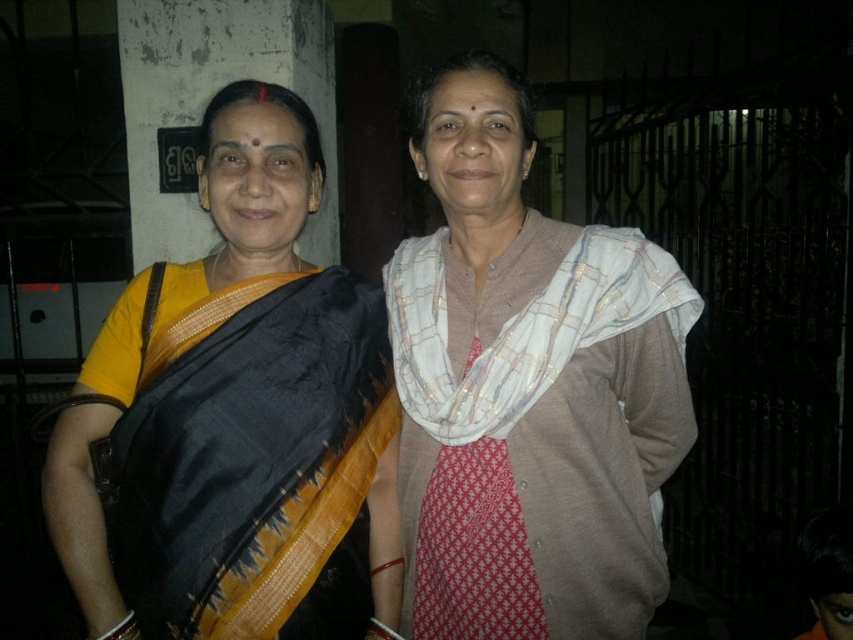
Looking at this image, measure the distance from matte brown scarf at center to white textured scarf at center.

The distance of matte brown scarf at center from white textured scarf at center is 3.25 inches.

Does matte brown scarf at center appear on the right side of white textured scarf at center?

Correct, you'll find matte brown scarf at center to the right of white textured scarf at center.

The height and width of the screenshot is (640, 853). In order to click on matte brown scarf at center in this screenshot , I will do `click(527, 388)`.

Is silk saree at left shorter than matte brown scarf at center?

Yes, silk saree at left is shorter than matte brown scarf at center.

Is point (141, 518) closer to viewer compared to point (664, 572)?

Yes, it is.

The width and height of the screenshot is (853, 640). I want to click on silk saree at left, so click(236, 417).

Between silk saree at left and white textured scarf at center, which one is positioned higher?

white textured scarf at center is above.

Between silk saree at left and white textured scarf at center, which one appears on the right side from the viewer's perspective?

white textured scarf at center is more to the right.

Find the location of a particular element. Image resolution: width=853 pixels, height=640 pixels. silk saree at left is located at coordinates (236, 417).

Image resolution: width=853 pixels, height=640 pixels. I want to click on silk saree at left, so click(236, 417).